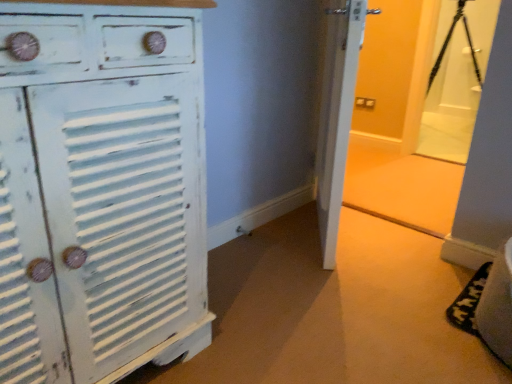
This screenshot has height=384, width=512. What do you see at coordinates (101, 189) in the screenshot?
I see `distressed white cabinet at left` at bounding box center [101, 189].

This screenshot has width=512, height=384. I want to click on distressed white cabinet at left, so click(x=101, y=189).

What do you see at coordinates (448, 43) in the screenshot? Image resolution: width=512 pixels, height=384 pixels. I see `black matte tripod at upper right` at bounding box center [448, 43].

You are a GUI agent. You are given a task and a screenshot of the screen. Output one action in this format:
    pyautogui.click(x=<x>, y=<y>)
    Task: Click on the black matte tripod at upper right
    
    Given the screenshot: What is the action you would take?
    pyautogui.click(x=448, y=43)

At what (x,y) coordinates should I click in order to perform the action: click on distressed white cabinet at left. Please return your answer as a coordinate pair (x, y). Looking at the image, I should click on (101, 189).

Consider the image. Based on their positions, is distressed white cabinet at left located to the left or right of black matte tripod at upper right?

In the image, distressed white cabinet at left appears on the left side of black matte tripod at upper right.

Between distressed white cabinet at left and black matte tripod at upper right, which one is positioned in front?

distressed white cabinet at left is more forward.

Which is in front, point (118, 198) or point (476, 74)?

The point (118, 198) is in front.

From the image's perspective, who appears lower, distressed white cabinet at left or black matte tripod at upper right?

distressed white cabinet at left is shown below in the image.

From a real-world perspective, is distressed white cabinet at left above or below black matte tripod at upper right?

distressed white cabinet at left is situated lower than black matte tripod at upper right in the real world.

Can you confirm if distressed white cabinet at left is thinner than black matte tripod at upper right?

Incorrect, the width of distressed white cabinet at left is not less than that of black matte tripod at upper right.

Considering the relative sizes of distressed white cabinet at left and black matte tripod at upper right in the image provided, is distressed white cabinet at left shorter than black matte tripod at upper right?

No.

Who is bigger, distressed white cabinet at left or black matte tripod at upper right?

With larger size is distressed white cabinet at left.

In the scene shown: Would you say distressed white cabinet at left is inside or outside black matte tripod at upper right?

distressed white cabinet at left is located beyond the bounds of black matte tripod at upper right.

Is distressed white cabinet at left beside black matte tripod at upper right?

No, distressed white cabinet at left is not with black matte tripod at upper right.

Is distressed white cabinet at left aimed at black matte tripod at upper right?

No, distressed white cabinet at left is not facing towards black matte tripod at upper right.

Can you tell me how much distressed white cabinet at left and black matte tripod at upper right differ in facing direction?

The facing directions of distressed white cabinet at left and black matte tripod at upper right are 82.5 degrees apart.

Image resolution: width=512 pixels, height=384 pixels. Find the location of `tripod on the right of the distressed white cabinet at left`. tripod on the right of the distressed white cabinet at left is located at coordinates (448, 43).

Consider the image. Considering the positions of objects black matte tripod at upper right and distressed white cabinet at left in the image provided, who is more to the left, black matte tripod at upper right or distressed white cabinet at left?

distressed white cabinet at left is more to the left.

Between black matte tripod at upper right and distressed white cabinet at left, which one is positioned behind?

black matte tripod at upper right is further from the camera.

Between point (479, 85) and point (47, 209), which one is positioned in front?

Positioned in front is point (47, 209).

From the image's perspective, relative to distressed white cabinet at left, is black matte tripod at upper right above or below?

From the image's perspective, black matte tripod at upper right appears above distressed white cabinet at left.

From a real-world perspective, is black matte tripod at upper right positioned above or below distressed white cabinet at left?

black matte tripod at upper right is situated higher than distressed white cabinet at left in the real world.

Does black matte tripod at upper right have a greater width compared to distressed white cabinet at left?

No.

Who is shorter, black matte tripod at upper right or distressed white cabinet at left?

black matte tripod at upper right.

Considering the sizes of objects black matte tripod at upper right and distressed white cabinet at left in the image provided, who is smaller, black matte tripod at upper right or distressed white cabinet at left?

black matte tripod at upper right is smaller.

Would you say black matte tripod at upper right is outside distressed white cabinet at left?

Yes, black matte tripod at upper right is located beyond the bounds of distressed white cabinet at left.

Is black matte tripod at upper right next to distressed white cabinet at left?

No, black matte tripod at upper right is not beside distressed white cabinet at left.

Could you tell me if black matte tripod at upper right is facing distressed white cabinet at left?

Yes, black matte tripod at upper right is aimed at distressed white cabinet at left.

How distant is black matte tripod at upper right from distressed white cabinet at left?

4.84 meters.

What are the coordinates of `tripod located on the right of distressed white cabinet at left` in the screenshot? It's located at (448, 43).

This screenshot has height=384, width=512. In order to click on the chest of drawers below the black matte tripod at upper right (from a real-world perspective) in this screenshot , I will do `click(101, 189)`.

This screenshot has width=512, height=384. What are the coordinates of `chest of drawers in front of the black matte tripod at upper right` in the screenshot? It's located at (101, 189).